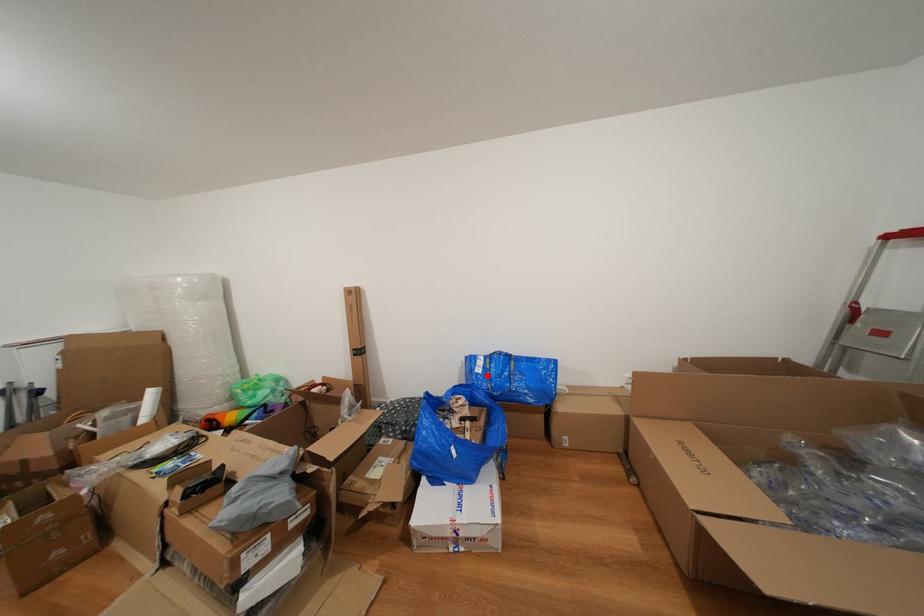
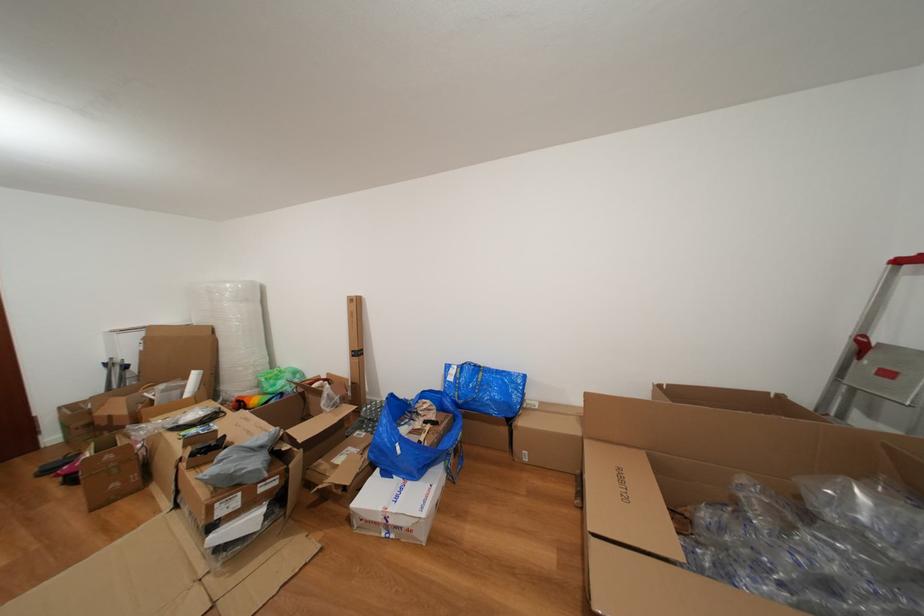
Where in the second image is the point corresponding to the highlighted location from the first image?

(458, 384)